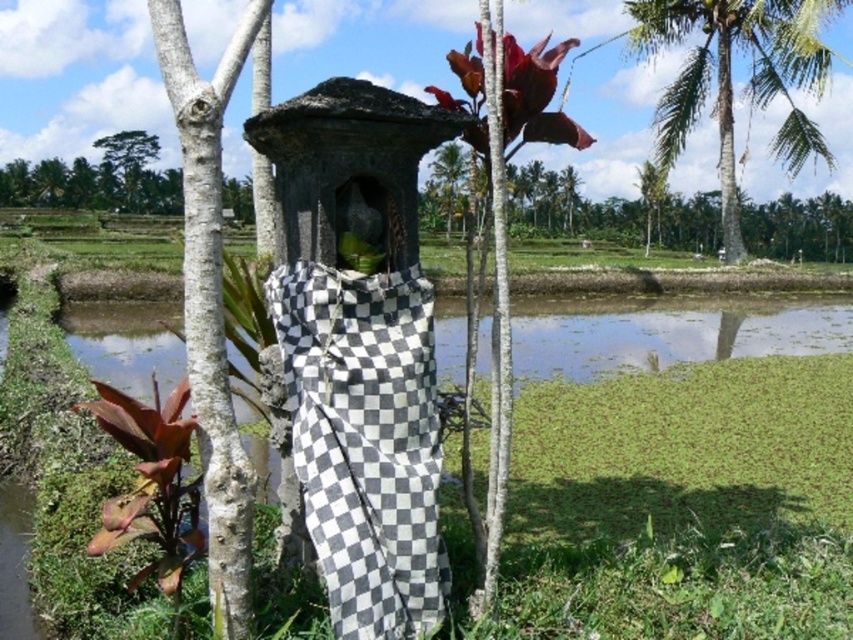
You are a photographer standing at the base of the tree with the leathery red leaf at upper center. You want to take a photo of it without any obstructions. Since you can move forward or backward, what is the minimum distance you should be from the leaf to ensure it fills the frame properly?

The minimum distance you should be from the leathery red leaf at upper center is approximately 9.96 feet to ensure it fills the frame properly without obstructions.

You are an artist planning to paint the scene. You want to ensure the black and white checkered cloth at center and the green leafy palm at upper right are proportionally accurate. Which object should you paint first to maintain the correct size relationship?

The black and white checkered cloth at center should be painted first since it is smaller than the green leafy palm at upper right, allowing you to establish the scale before working on the larger object.